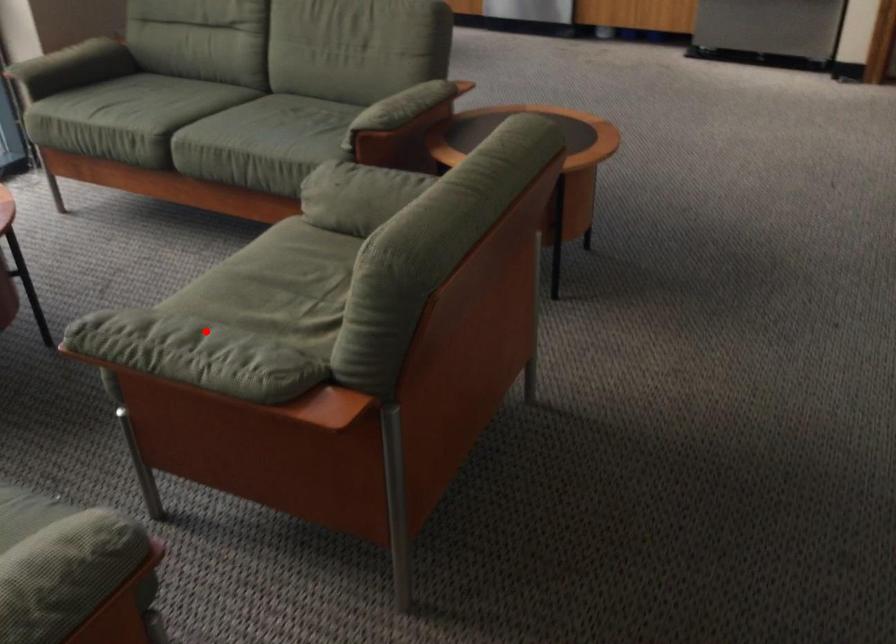
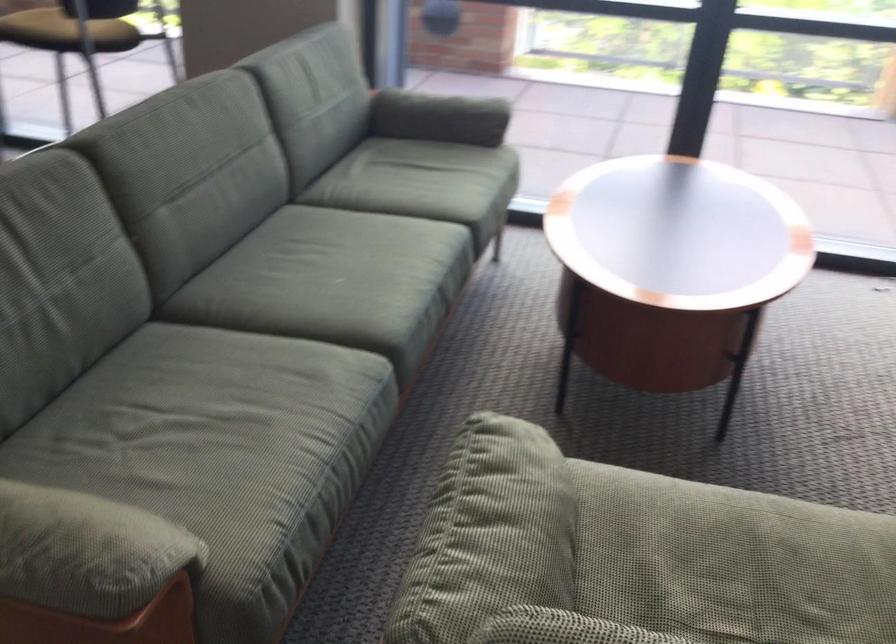
In the second image, find the point that corresponds to the highlighted location in the first image.

(500, 527)